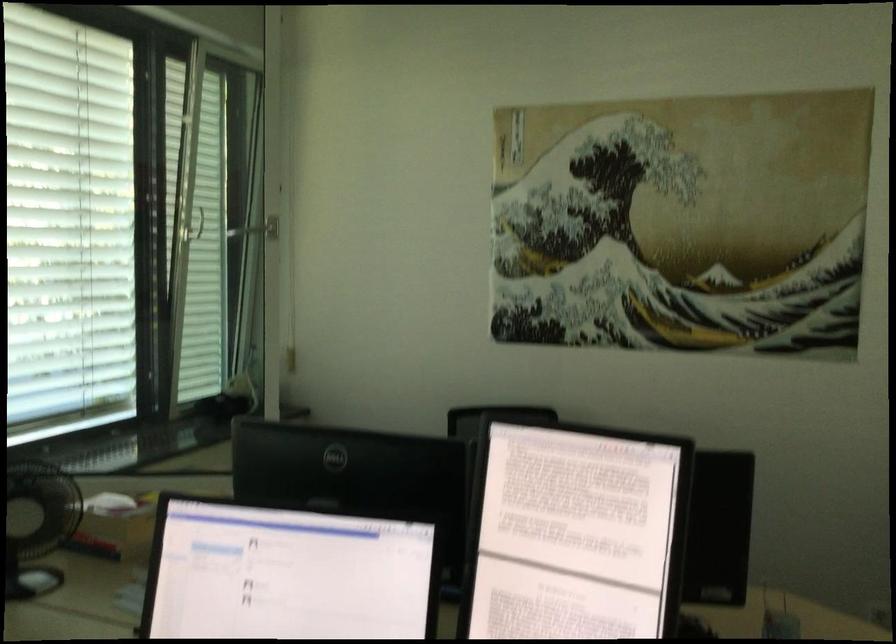
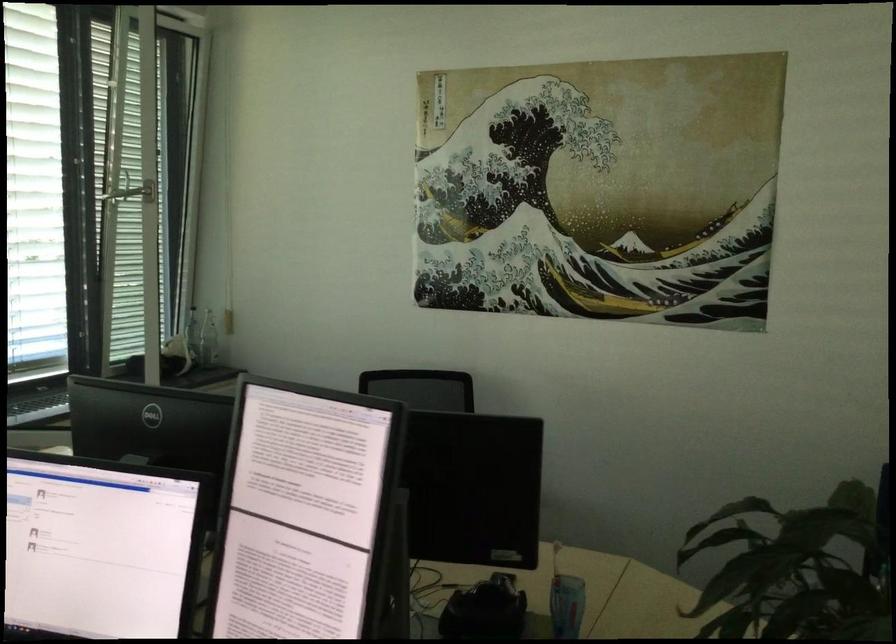
Question: Based on the continuous images, in which direction is the camera rotating? Reply with the corresponding letter.

Choices:
 (A) Left
 (B) Right
 (C) Up
 (D) Down

Answer: (A)